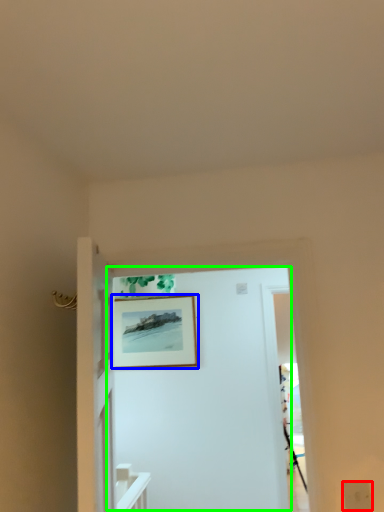
Question: Based on their relative distances, which object is nearer to electric outlet (highlighted by a red box)? Choose from picture frame (highlighted by a blue box) and door (highlighted by a green box).

Choices:
 (A) picture frame
 (B) door

Answer: (B)